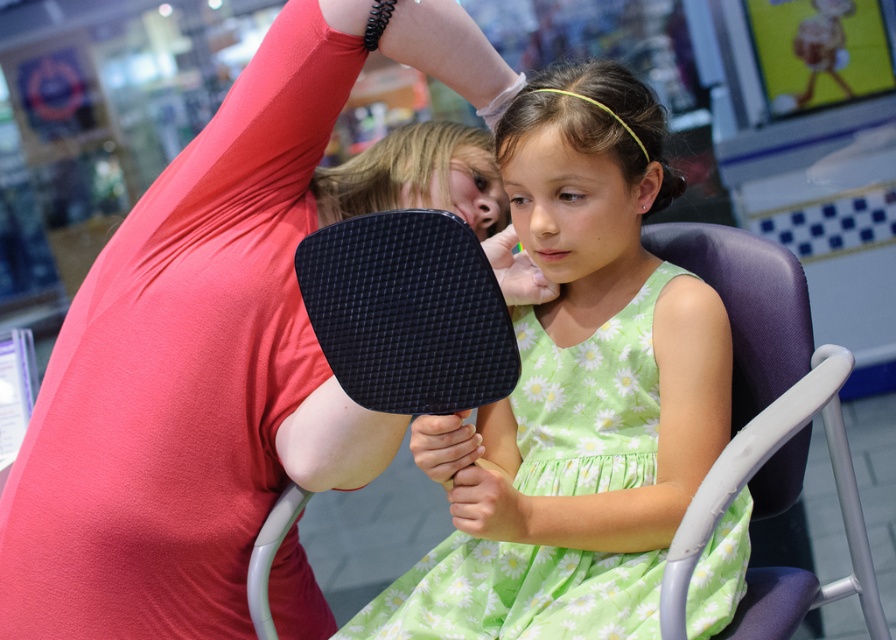
Question: Which point is farther to the camera?

Choices:
 (A) green floral fabric dress at center
 (B) matte pink dress at center

Answer: (B)

Question: Can you confirm if matte pink dress at center is positioned to the right of green floral fabric dress at center?

Choices:
 (A) no
 (B) yes

Answer: (A)

Question: Which object is farther from the camera taking this photo?

Choices:
 (A) matte pink dress at center
 (B) green floral fabric dress at center

Answer: (A)

Question: Can you confirm if matte pink dress at center is bigger than green floral fabric dress at center?

Choices:
 (A) yes
 (B) no

Answer: (A)

Question: Which of the following is the closest to the observer?

Choices:
 (A) matte pink dress at center
 (B) green floral fabric dress at center

Answer: (B)

Question: Does matte pink dress at center appear under green floral fabric dress at center?

Choices:
 (A) yes
 (B) no

Answer: (B)